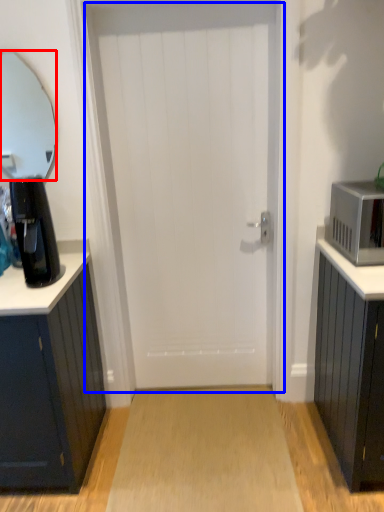
Question: Which point is further to the camera, mirror (highlighted by a red box) or door (highlighted by a blue box)?

Choices:
 (A) mirror
 (B) door

Answer: (A)